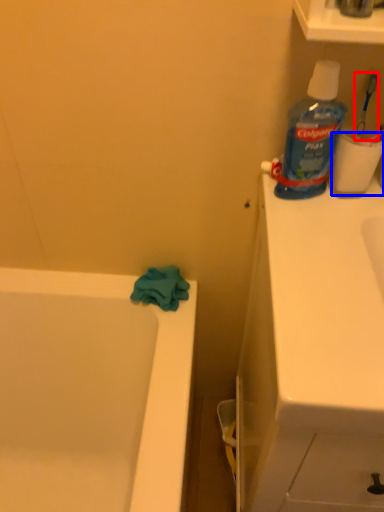
Question: Which object is further to the camera taking this photo, toothbrush (highlighted by a red box) or toilet paper (highlighted by a blue box)?

Choices:
 (A) toothbrush
 (B) toilet paper

Answer: (B)